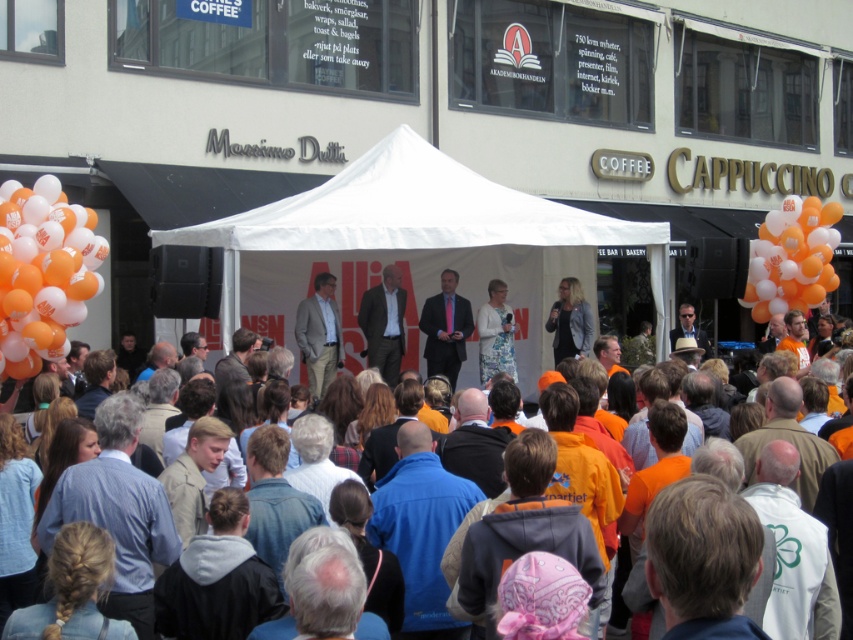
Does orange matte balloon at left have a larger size compared to orange matte balloons at right?

Incorrect, orange matte balloon at left is not larger than orange matte balloons at right.

Is point (26, 336) farther from camera compared to point (834, 241)?

No, (26, 336) is closer to viewer.

Who is more forward, (68, 211) or (807, 225)?

Positioned in front is point (68, 211).

At what (x,y) coordinates should I click in order to perform the action: click on orange matte balloon at left. Please return your answer as a coordinate pair (x, y). Looking at the image, I should click on (44, 272).

Who is shorter, orange matte balloons at right or orange fabric crowd at center?

With less height is orange matte balloons at right.

Is orange matte balloons at right closer to the viewer compared to orange fabric crowd at center?

No, orange matte balloons at right is further to the viewer.

This screenshot has width=853, height=640. I want to click on orange matte balloons at right, so click(792, 257).

Which is more to the right, orange matte balloon at left or matte black suit at center?

From the viewer's perspective, matte black suit at center appears more on the right side.

Can you confirm if orange matte balloon at left is taller than matte black suit at center?

Yes.

What do you see at coordinates (44, 272) in the screenshot?
I see `orange matte balloon at left` at bounding box center [44, 272].

Image resolution: width=853 pixels, height=640 pixels. Find the location of `orange matte balloon at left`. orange matte balloon at left is located at coordinates (44, 272).